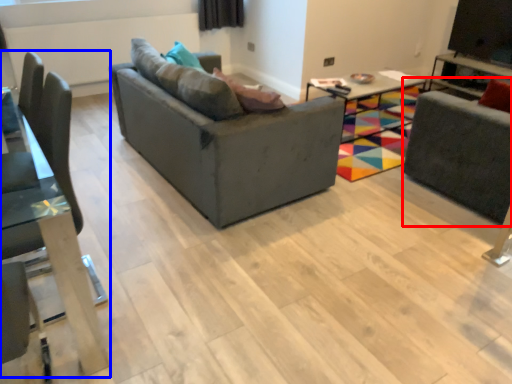
Question: Which object appears closest to the camera in this image, swivel chair (highlighted by a red box) or chair (highlighted by a blue box)?

Choices:
 (A) swivel chair
 (B) chair

Answer: (B)